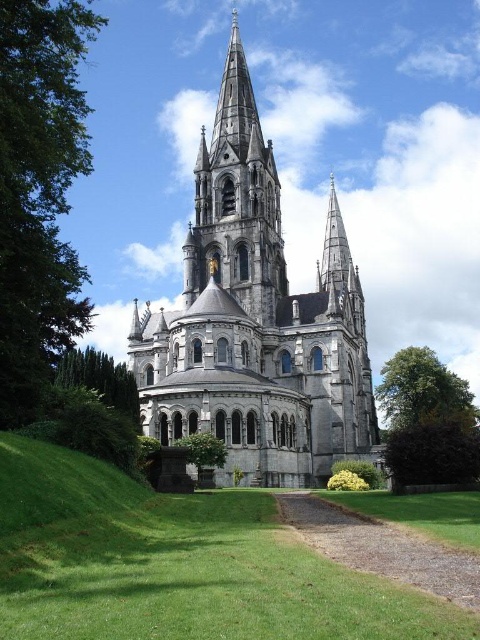
Looking at this image, does green grass at center have a lesser height compared to green leafy tree at lower left?

Yes.

Does green grass at center have a greater height compared to green leafy tree at lower left?

In fact, green grass at center may be shorter than green leafy tree at lower left.

Does point (374, 628) come in front of point (103, 396)?

Yes, point (374, 628) is in front of point (103, 396).

At what (x,y) coordinates should I click in order to perform the action: click on green grass at center. Please return your answer as a coordinate pair (x, y). Looking at the image, I should click on 177,564.

Can you confirm if gray stone spire at center is shorter than green leafy tree at lower left?

No, gray stone spire at center is not shorter than green leafy tree at lower left.

Does point (275, 237) lie behind point (131, 412)?

Yes, point (275, 237) is behind point (131, 412).

Describe the element at coordinates (237, 202) in the screenshot. I see `gray stone spire at center` at that location.

Locate an element on the screen. gray stone spire at center is located at coordinates (237, 202).

Is green leafy tree at upper left positioned before gray stone spire at center?

Yes, it is.

Which is in front, point (14, 67) or point (252, 218)?

Point (14, 67)

You are a GUI agent. You are given a task and a screenshot of the screen. Output one action in this format:
    pyautogui.click(x=<x>, y=<y>)
    Task: Click on the green leafy tree at upper left
    The width and height of the screenshot is (480, 640).
    Given the screenshot: What is the action you would take?
    38,189